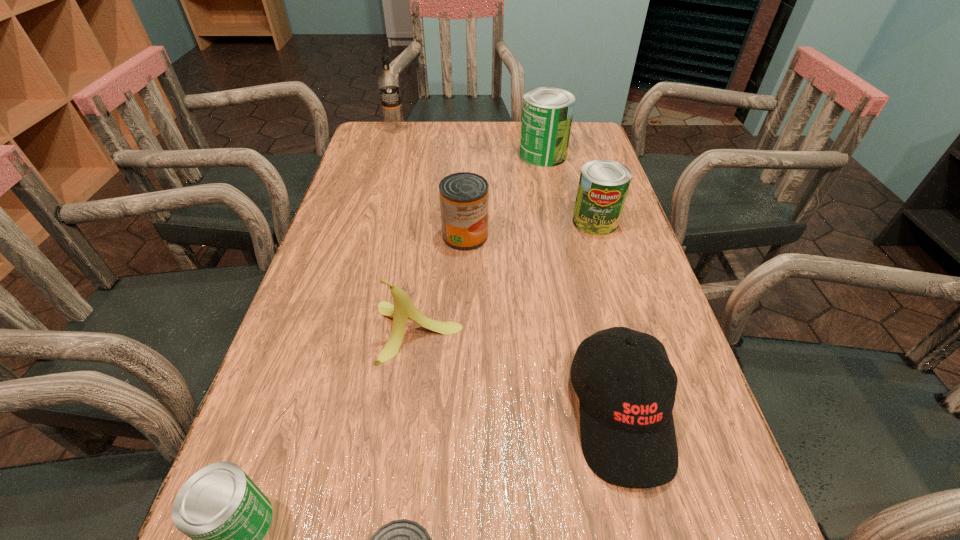
Point out which can is positioned as the third nearest to the nearer red can. Please provide its 2D coordinates. Your answer should be formatted as a tuple, i.e. [(x, y)], where the tuple contains the x and y coordinates of a point satisfying the conditions above.

[(603, 185)]

This screenshot has width=960, height=540. In order to click on can that is the closest one to the leftmost green can in this screenshot , I will do `click(403, 539)`.

Choose which green can is the third nearest neighbor to the banana. Please provide its 2D coordinates. Your answer should be formatted as a tuple, i.e. [(x, y)], where the tuple contains the x and y coordinates of a point satisfying the conditions above.

[(547, 113)]

Select which green can is the second closest to the second farthest green can. Please provide its 2D coordinates. Your answer should be formatted as a tuple, i.e. [(x, y)], where the tuple contains the x and y coordinates of a point satisfying the conditions above.

[(226, 515)]

Locate an element on the screen. free spot that satisfies the following two spatial constraints: 1. on the label of the banana; 2. on the left side of the vodka is located at coordinates (336, 332).

Find the location of a particular element. This screenshot has width=960, height=540. free space that satisfies the following two spatial constraints: 1. on the label of the tallest object; 2. on the right side of the farthest can is located at coordinates (388, 155).